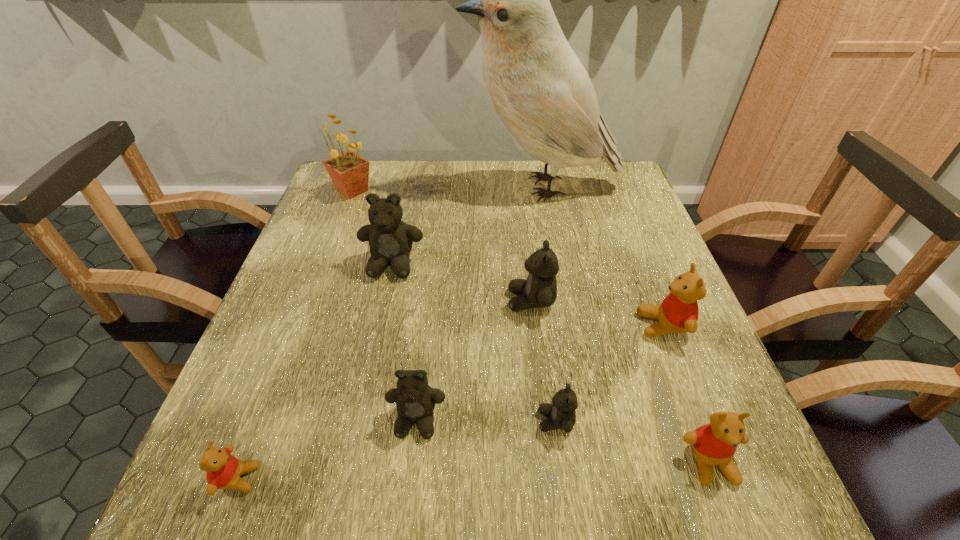
Where is `vacant point that satisfies the following two spatial constraints: 1. on the face of the biggest brown teddy bear; 2. on the front-facing side of the leftmost red teddy bear`? The height and width of the screenshot is (540, 960). vacant point that satisfies the following two spatial constraints: 1. on the face of the biggest brown teddy bear; 2. on the front-facing side of the leftmost red teddy bear is located at coordinates (347, 478).

The width and height of the screenshot is (960, 540). Find the location of `free spot that satisfies the following two spatial constraints: 1. on the front-facing side of the biggest red teddy bear; 2. on the front-facing side of the second biggest red teddy bear`. free spot that satisfies the following two spatial constraints: 1. on the front-facing side of the biggest red teddy bear; 2. on the front-facing side of the second biggest red teddy bear is located at coordinates (716, 463).

In order to click on free space that satisfies the following two spatial constraints: 1. on the face of the parakeet; 2. on the face of the third biggest brown teddy bear in this screenshot , I will do `click(583, 420)`.

Image resolution: width=960 pixels, height=540 pixels. Identify the location of blank area in the image that satisfies the following two spatial constraints: 1. on the front-facing side of the farthest red teddy bear; 2. on the front-facing side of the second biggest red teddy bear. (716, 463).

You are a GUI agent. You are given a task and a screenshot of the screen. Output one action in this format:
    pyautogui.click(x=<x>, y=<y>)
    Task: Click on the free space that satisfies the following two spatial constraints: 1. on the face of the second smallest brown teddy bear; 2. on the front-facing side of the smallest red teddy bear
    
    Given the screenshot: What is the action you would take?
    pyautogui.click(x=410, y=478)